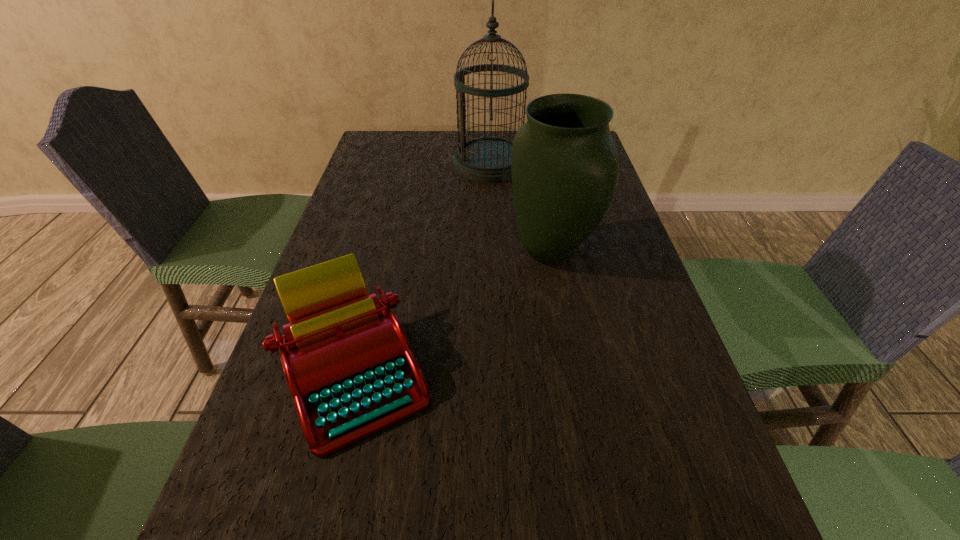
Image resolution: width=960 pixels, height=540 pixels. What are the coordinates of `birdcage` in the screenshot? It's located at (487, 159).

I want to click on the tallest object, so tap(487, 159).

The width and height of the screenshot is (960, 540). Find the location of `vase`. vase is located at coordinates (564, 165).

The width and height of the screenshot is (960, 540). I want to click on the second nearest object, so click(x=564, y=165).

I want to click on typewriter, so click(346, 358).

Locate an element on the screen. the shortest object is located at coordinates (346, 358).

Find the location of `free point located 0.290m on the front-facing side of the tallest object`. free point located 0.290m on the front-facing side of the tallest object is located at coordinates (363, 164).

At what (x,y) coordinates should I click in order to perform the action: click on vacant region located 0.140m on the front-facing side of the tallest object. Please return your answer as a coordinate pair (x, y). Image resolution: width=960 pixels, height=540 pixels. Looking at the image, I should click on (409, 164).

Image resolution: width=960 pixels, height=540 pixels. I want to click on free space located on the front-facing side of the tallest object, so click(372, 164).

The width and height of the screenshot is (960, 540). Identify the location of blank space located 0.230m on the back of the second nearest object. (538, 180).